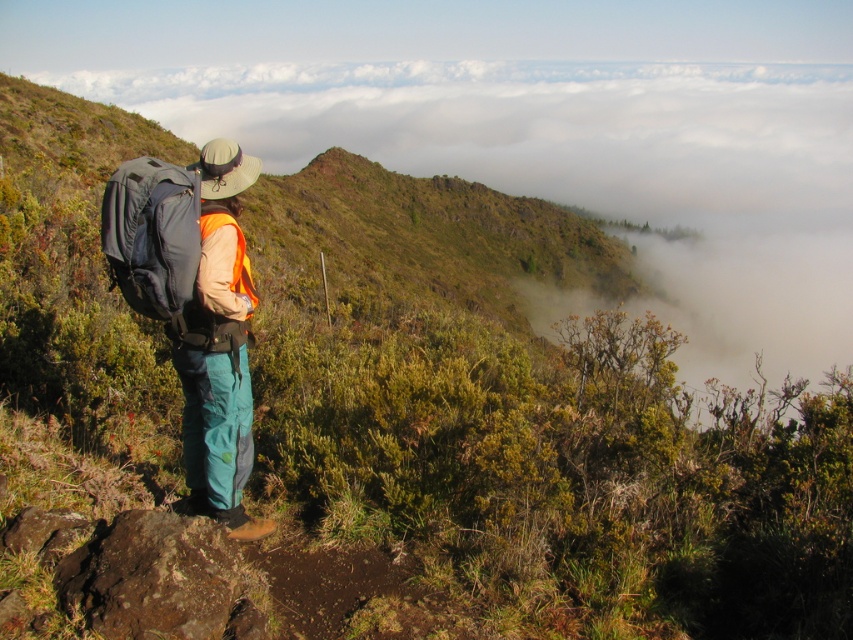
Question: Which point appears closest to the camera in this image?

Choices:
 (A) (149, 292)
 (B) (206, 220)

Answer: (A)

Question: Among these points, which one is nearest to the camera?

Choices:
 (A) (196, 177)
 (B) (213, 328)

Answer: (B)

Question: Can you confirm if matte blue backpack at center is positioned to the left of matte black backpack at center?

Choices:
 (A) yes
 (B) no

Answer: (B)

Question: Is matte blue backpack at center smaller than matte black backpack at center?

Choices:
 (A) no
 (B) yes

Answer: (B)

Question: Is matte blue backpack at center below matte black backpack at center?

Choices:
 (A) yes
 (B) no

Answer: (A)